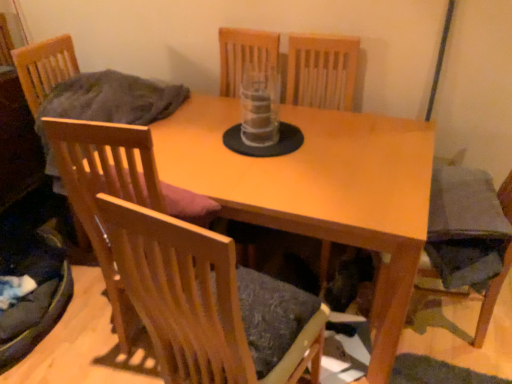
What do you see at coordinates (44, 67) in the screenshot? The width and height of the screenshot is (512, 384). I see `wooden chair at left, which ranks as the 1th chair in left-to-right order` at bounding box center [44, 67].

What do you see at coordinates (490, 300) in the screenshot? I see `velvet dark grey armchair at lower right` at bounding box center [490, 300].

At what (x,y) coordinates should I click in order to perform the action: click on wooden chair at center, acting as the 2th chair starting from the left. Please return your answer as a coordinate pair (x, y). Looking at the image, I should click on (113, 193).

In order to face light wood table at center, should I rotate leftwards or rightwards?

It's best to rotate right around 1.887 degrees.

Describe the element at coordinates (206, 301) in the screenshot. This screenshot has width=512, height=384. I see `wooden chair at center, which is the 1th chair in right-to-left order` at that location.

Locate an element on the screen. wooden chair at left, which ranks as the 1th chair in left-to-right order is located at coordinates (44, 67).

From a real-world perspective, relative to velvet dark grey armchair at lower right, is wooden chair at center, acting as the 2th chair starting from the left, vertically above or below?

From a real-world perspective, wooden chair at center, acting as the 2th chair starting from the left, is physically above velvet dark grey armchair at lower right.

Are wooden chair at center, acting as the 2th chair starting from the left, and velvet dark grey armchair at lower right beside each other?

No, wooden chair at center, acting as the 2th chair starting from the left, is not next to velvet dark grey armchair at lower right.

Is wooden chair at center, acting as the 2th chair starting from the left, at the right side of velvet dark grey armchair at lower right?

In fact, wooden chair at center, acting as the 2th chair starting from the left, is to the left of velvet dark grey armchair at lower right.

Looking at this image, which object is wider, wooden chair at center, the second chair in the right-to-left sequence, or velvet dark grey armchair at lower right?

Wider between the two is velvet dark grey armchair at lower right.

Is wooden chair at left, which ranks as the 1th chair in left-to-right order, not near transparent plastic vase at center?

They are positioned close to each other.

Is wooden chair at left, which ranks as the 1th chair in left-to-right order, located outside transparent plastic vase at center?

Yes, wooden chair at left, which ranks as the 1th chair in left-to-right order, is outside of transparent plastic vase at center.

Which object is positioned more to the left, wooden chair at left, which ranks as the 1th chair in left-to-right order, or transparent plastic vase at center?

From the viewer's perspective, wooden chair at left, which ranks as the 1th chair in left-to-right order, appears more on the left side.

From a real-world perspective, is wooden chair at left, the 3th chair when ordered from right to left, on transparent plastic vase at center?

No, from a real-world perspective, wooden chair at left, the 3th chair when ordered from right to left, is not above transparent plastic vase at center.

What are the coordinates of `glass vase above the wooden chair at left, the 3th chair when ordered from right to left (from a real-world perspective)` in the screenshot? It's located at (259, 106).

Is point (243, 92) in front of point (49, 70)?

That is True.

Considering the sizes of transparent plastic vase at center and velvet dark grey armchair at lower right in the image, is transparent plastic vase at center taller or shorter than velvet dark grey armchair at lower right?

transparent plastic vase at center is taller than velvet dark grey armchair at lower right.

Can we say transparent plastic vase at center lies outside velvet dark grey armchair at lower right?

Yes, transparent plastic vase at center is located beyond the bounds of velvet dark grey armchair at lower right.

Is transparent plastic vase at center next to velvet dark grey armchair at lower right?

There is a gap between transparent plastic vase at center and velvet dark grey armchair at lower right.

Is transparent plastic vase at center positioned with its back to velvet dark grey armchair at lower right?

No, transparent plastic vase at center is not facing away from velvet dark grey armchair at lower right.

From the image's perspective, is velvet dark grey armchair at lower right on top of light wood table at center?

Actually, velvet dark grey armchair at lower right appears below light wood table at center in the image.

Where is `armchair above the light wood table at center (from a real-world perspective)`? Image resolution: width=512 pixels, height=384 pixels. armchair above the light wood table at center (from a real-world perspective) is located at coordinates tap(490, 300).

Which object is further away from the camera taking this photo, velvet dark grey armchair at lower right or light wood table at center?

A: Positioned behind is velvet dark grey armchair at lower right.

Can you tell me how much transparent plastic vase at center and wooden chair at center, which is the 1th chair in right-to-left order, differ in facing direction?

The angular difference between transparent plastic vase at center and wooden chair at center, which is the 1th chair in right-to-left order, is 171 degrees.

From their relative heights in the image, would you say transparent plastic vase at center is taller or shorter than wooden chair at center, which is the 1th chair in right-to-left order?

Clearly, transparent plastic vase at center is shorter compared to wooden chair at center, which is the 1th chair in right-to-left order.

From the image's perspective, is transparent plastic vase at center above wooden chair at center, acting as the third chair starting from the left?

Yes, from the image's perspective, transparent plastic vase at center is over wooden chair at center, acting as the third chair starting from the left.

Considering the positions of points (248, 76) and (281, 376), is point (248, 76) farther from camera compared to point (281, 376)?

Yes, it is behind point (281, 376).

Find the location of a particular element. The width and height of the screenshot is (512, 384). chair that is the 3rd object above the velvet dark grey armchair at lower right (from a real-world perspective) is located at coordinates (113, 193).

In terms of height, does velvet dark grey armchair at lower right look taller or shorter compared to wooden chair at center, acting as the 2th chair starting from the left?

velvet dark grey armchair at lower right is shorter than wooden chair at center, acting as the 2th chair starting from the left.

Based on the photo, from the image's perspective, relative to wooden chair at center, acting as the 2th chair starting from the left, is velvet dark grey armchair at lower right above or below?

From the image's perspective, velvet dark grey armchair at lower right appears below wooden chair at center, acting as the 2th chair starting from the left.

Is velvet dark grey armchair at lower right oriented away from wooden chair at center, the second chair in the right-to-left sequence?

No.

From a real-world perspective, starting from the velvet dark grey armchair at lower right, which chair is the 3rd one vertically above it? Please provide its 2D coordinates.

[(113, 193)]

Where is `the 3rd chair to the left when counting from the transparent plastic vase at center`? This screenshot has height=384, width=512. the 3rd chair to the left when counting from the transparent plastic vase at center is located at coordinates (44, 67).

Looking at the image, which one is located further to light wood table at center, velvet dark grey armchair at lower right or wooden chair at center, the second chair in the right-to-left sequence?

velvet dark grey armchair at lower right is further to light wood table at center.

Which object lies nearer to the anchor point wooden chair at left, the 3th chair when ordered from right to left, velvet dark grey armchair at lower right or wooden chair at center, the second chair in the right-to-left sequence?

wooden chair at center, the second chair in the right-to-left sequence, is closer to wooden chair at left, the 3th chair when ordered from right to left.

Based on their spatial positions, is transparent plastic vase at center or wooden chair at left, which ranks as the 1th chair in left-to-right order, further from wooden chair at center, which is the 1th chair in right-to-left order?

wooden chair at left, which ranks as the 1th chair in left-to-right order.

When comparing their distances from light wood table at center, does wooden chair at center, the second chair in the right-to-left sequence, or velvet dark grey armchair at lower right seem further?

The object further to light wood table at center is velvet dark grey armchair at lower right.

Considering their positions, is velvet dark grey armchair at lower right positioned further to wooden chair at center, the second chair in the right-to-left sequence, than light wood table at center?

Based on the image, velvet dark grey armchair at lower right appears to be further to wooden chair at center, the second chair in the right-to-left sequence.

Estimate the real-world distances between objects in this image. Which object is closer to transparent plastic vase at center, wooden chair at left, the 3th chair when ordered from right to left, or wooden chair at center, the second chair in the right-to-left sequence?

wooden chair at center, the second chair in the right-to-left sequence, is closer to transparent plastic vase at center.

When comparing their distances from transparent plastic vase at center, does velvet dark grey armchair at lower right or wooden chair at left, which ranks as the 1th chair in left-to-right order, seem closer?

Among the two, wooden chair at left, which ranks as the 1th chair in left-to-right order, is located nearer to transparent plastic vase at center.

Looking at the image, which one is located closer to light wood table at center, wooden chair at center, which is the 1th chair in right-to-left order, or transparent plastic vase at center?

transparent plastic vase at center is closer to light wood table at center.

This screenshot has height=384, width=512. Find the location of `glass vase located between wooden chair at left, which ranks as the 1th chair in left-to-right order, and velvet dark grey armchair at lower right in the left-right direction`. glass vase located between wooden chair at left, which ranks as the 1th chair in left-to-right order, and velvet dark grey armchair at lower right in the left-right direction is located at coordinates [259, 106].

This screenshot has height=384, width=512. In order to click on chair between wooden chair at center, acting as the 2th chair starting from the left, and velvet dark grey armchair at lower right from left to right in this screenshot , I will do `click(206, 301)`.

You are a GUI agent. You are given a task and a screenshot of the screen. Output one action in this format:
    pyautogui.click(x=<x>, y=<y>)
    Task: Click on the table positioned between wooden chair at center, acting as the third chair starting from the left, and wooden chair at left, the 3th chair when ordered from right to left, from near to far
    The image size is (512, 384).
    Given the screenshot: What is the action you would take?
    pyautogui.click(x=319, y=189)

Find the location of a particular element. This screenshot has height=384, width=512. chair between wooden chair at center, acting as the third chair starting from the left, and transparent plastic vase at center in the front-back direction is located at coordinates (113, 193).